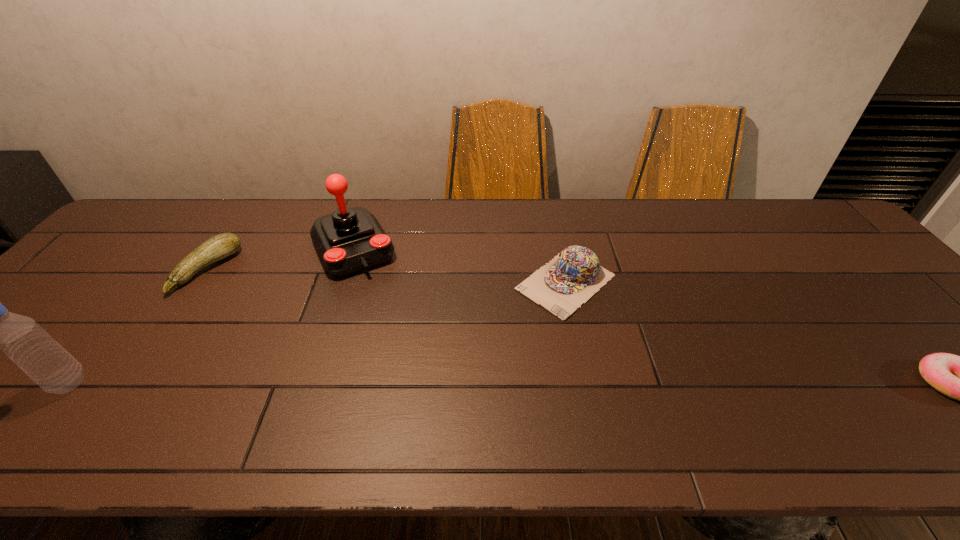
Where is `free space located 0.190m on the base of the joystick`? free space located 0.190m on the base of the joystick is located at coordinates [391, 323].

What are the coordinates of `vacant space located at the stem end of the zucchini` in the screenshot? It's located at (255, 307).

Locate an element on the screen. vacant space located at the stem end of the zucchini is located at coordinates (x=281, y=323).

The image size is (960, 540). In order to click on blank area located 0.150m at the stem end of the zucchini in this screenshot , I will do `click(255, 307)`.

Find the location of a particular element. Image resolution: width=960 pixels, height=540 pixels. object located in the far edge section of the desktop is located at coordinates (350, 240).

Find the location of a particular element. object situated at the near edge is located at coordinates (22, 339).

Locate an element on the screen. The height and width of the screenshot is (540, 960). vacant region at the far edge of the desktop is located at coordinates (673, 211).

Find the location of a particular element. free space at the left edge is located at coordinates (107, 309).

Where is `vacant space at the right edge`? This screenshot has height=540, width=960. vacant space at the right edge is located at coordinates (x=908, y=353).

In the image, there is a desktop. Where is `vacant space at the far left corner`? This screenshot has height=540, width=960. vacant space at the far left corner is located at coordinates (179, 200).